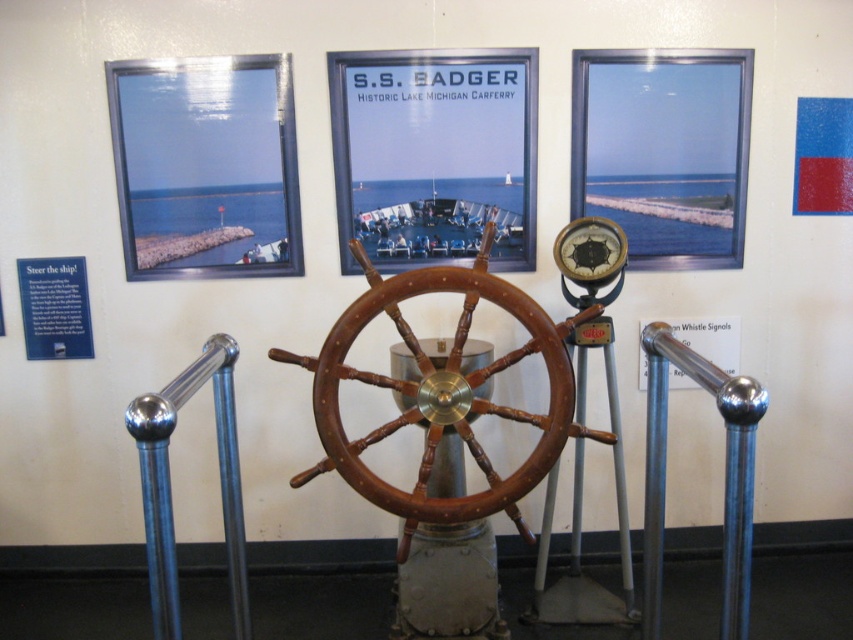
Is point (646, 474) less distant than point (160, 449)?

No, (646, 474) is behind (160, 449).

Who is positioned more to the right, polished metal pole at center or polished metal pole at left?

From the viewer's perspective, polished metal pole at center appears more on the right side.

Who is more forward, (647,490) or (146,426)?

Point (146,426)

You are a GUI agent. You are given a task and a screenshot of the screen. Output one action in this format:
    pyautogui.click(x=<x>, y=<y>)
    Task: Click on the polished metal pole at center
    This screenshot has width=853, height=640.
    Given the screenshot: What is the action you would take?
    pyautogui.click(x=724, y=474)

Can you confirm if brown polished wood at center is taller than polished metal pole at left?

Correct, brown polished wood at center is much taller as polished metal pole at left.

Based on the photo, does brown polished wood at center appear over polished metal pole at left?

Correct, brown polished wood at center is located above polished metal pole at left.

Who is more forward, (326, 456) or (166, 563)?

Point (166, 563) is more forward.

The image size is (853, 640). I want to click on brown polished wood at center, so click(x=444, y=392).

Who is lower down, brown polished wood at center or matte black gauge at center?

brown polished wood at center is below.

Does brown polished wood at center lie in front of matte black gauge at center?

Yes, it is.

Which is in front, point (329, 452) or point (573, 280)?

Point (329, 452) is in front.

Identify the location of brown polished wood at center. (444, 392).